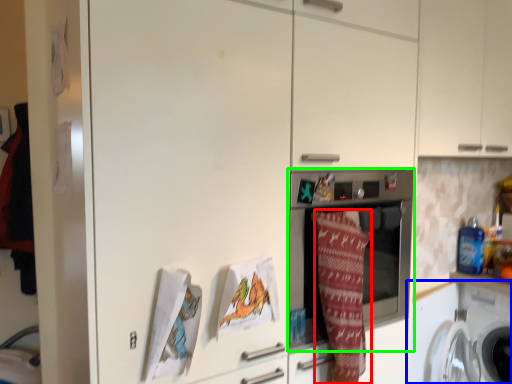
Question: Which is farther away from blanket (highlighted by a red box)? washing machine (highlighted by a blue box) or home appliance (highlighted by a green box)?

Choices:
 (A) washing machine
 (B) home appliance

Answer: (A)